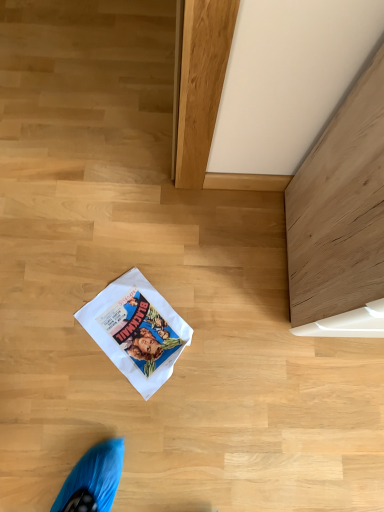
The height and width of the screenshot is (512, 384). I want to click on white paper comic book at center, so click(x=136, y=330).

The width and height of the screenshot is (384, 512). What do you see at coordinates (136, 330) in the screenshot? I see `white paper comic book at center` at bounding box center [136, 330].

Measure the distance between white paper comic book at center and camera.

white paper comic book at center is 3.56 feet away from camera.

You are a GUI agent. You are given a task and a screenshot of the screen. Output one action in this format:
    pyautogui.click(x=<x>, y=<y>)
    Task: Click on the white paper comic book at center
    Image resolution: width=384 pixels, height=512 pixels.
    Given the screenshot: What is the action you would take?
    pyautogui.click(x=136, y=330)